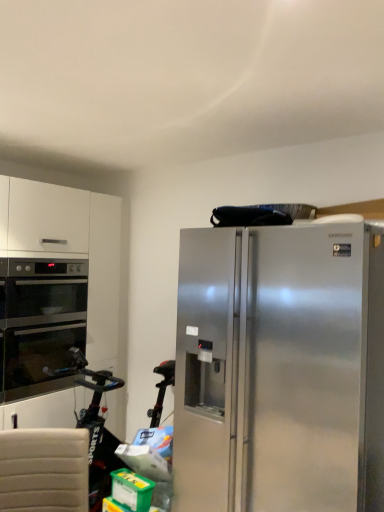
Question: From the image's perspective, is stainless steel oven at left over stainless steel refrigerator at right?

Choices:
 (A) no
 (B) yes

Answer: (B)

Question: Can you confirm if stainless steel oven at left is thinner than stainless steel refrigerator at right?

Choices:
 (A) no
 (B) yes

Answer: (B)

Question: Can you confirm if stainless steel oven at left is bigger than stainless steel refrigerator at right?

Choices:
 (A) yes
 (B) no

Answer: (B)

Question: From a real-world perspective, is stainless steel oven at left positioned over stainless steel refrigerator at right based on gravity?

Choices:
 (A) no
 (B) yes

Answer: (B)

Question: From the image's perspective, is stainless steel oven at left below stainless steel refrigerator at right?

Choices:
 (A) yes
 (B) no

Answer: (B)

Question: Is stainless steel oven at left directly adjacent to stainless steel refrigerator at right?

Choices:
 (A) no
 (B) yes

Answer: (A)

Question: Is stainless steel refrigerator at right facing towards stainless steel oven at left?

Choices:
 (A) no
 (B) yes

Answer: (A)

Question: From the image's perspective, is stainless steel refrigerator at right above stainless steel oven at left?

Choices:
 (A) yes
 (B) no

Answer: (B)

Question: Does stainless steel refrigerator at right come in front of stainless steel oven at left?

Choices:
 (A) yes
 (B) no

Answer: (A)

Question: Considering the relative sizes of stainless steel refrigerator at right and stainless steel oven at left in the image provided, is stainless steel refrigerator at right shorter than stainless steel oven at left?

Choices:
 (A) yes
 (B) no

Answer: (B)

Question: From the image's perspective, is stainless steel refrigerator at right located beneath stainless steel oven at left?

Choices:
 (A) yes
 (B) no

Answer: (A)

Question: Is stainless steel refrigerator at right next to stainless steel oven at left?

Choices:
 (A) yes
 (B) no

Answer: (B)

Question: Is stainless steel refrigerator at right wider or thinner than stainless steel oven at left?

Choices:
 (A) wide
 (B) thin

Answer: (A)